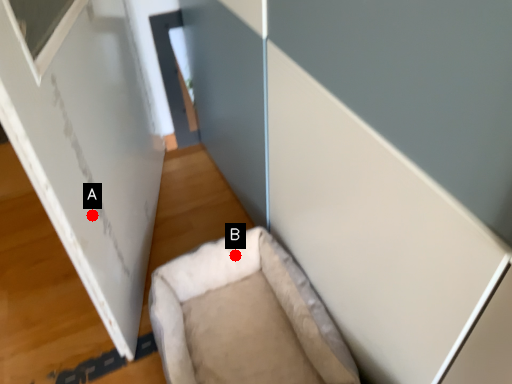
Question: Two points are circled on the image, labeled by A and B beside each circle. Among these points, which one is nearest to the camera?

Choices:
 (A) A is closer
 (B) B is closer

Answer: (A)